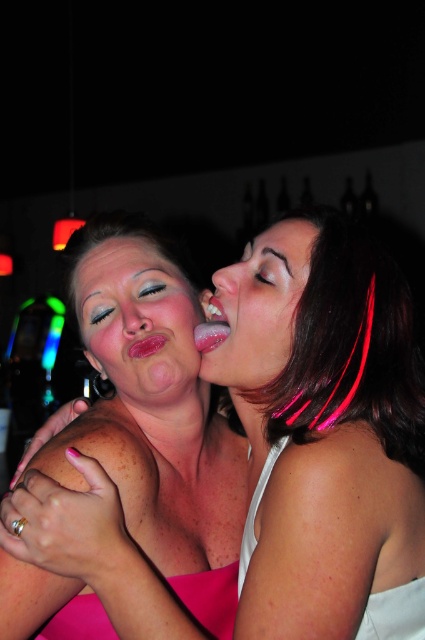
Which is behind, point (323, 604) or point (377, 593)?

The point (377, 593) is behind.

Between pink matte skin at center and white satin dress at shoulder, which one is positioned lower?

Positioned lower is white satin dress at shoulder.

Is point (419, 563) closer to camera compared to point (419, 595)?

No, (419, 563) is further to viewer.

Identify the location of pink matte skin at center. (325, 433).

Who is more forward, (215, 333) or (138, 353)?

Point (215, 333) is in front.

Looking at this image, between shiny pink lips at center and pink glossy lips at center, which one appears on the left side from the viewer's perspective?

Positioned to the left is pink glossy lips at center.

The height and width of the screenshot is (640, 425). Describe the element at coordinates (212, 326) in the screenshot. I see `shiny pink lips at center` at that location.

In order to click on shiny pink lips at center in this screenshot , I will do `click(212, 326)`.

Does satin skin face at center have a larger size compared to shiny pink lips at center?

Correct, satin skin face at center is larger in size than shiny pink lips at center.

Is point (237, 324) positioned before point (209, 332)?

Yes.

Who is more forward, (x=283, y=326) or (x=210, y=332)?

Positioned in front is point (x=283, y=326).

Find the location of a particular element. satin skin face at center is located at coordinates (255, 307).